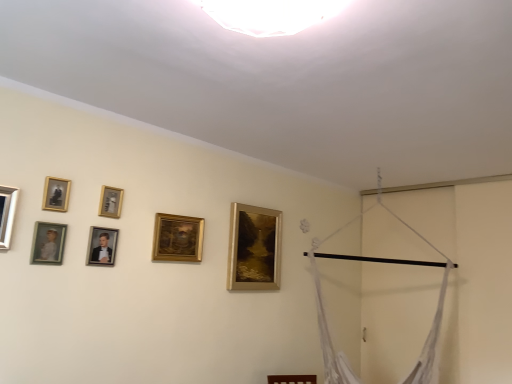
Where is `matte black picture frame at center left, the 4th picture frame from the back`? The width and height of the screenshot is (512, 384). matte black picture frame at center left, the 4th picture frame from the back is located at coordinates (102, 246).

What do you see at coordinates (56, 194) in the screenshot?
I see `gold-framed portrait at upper left, the third picture frame viewed from the front` at bounding box center [56, 194].

Describe the element at coordinates (48, 243) in the screenshot. I see `matte gold picture frame at left, which is the second picture frame in left-to-right order` at that location.

Image resolution: width=512 pixels, height=384 pixels. What do you see at coordinates (254, 248) in the screenshot?
I see `gold/golden frame at upper center, which is the first picture frame in back-to-front order` at bounding box center [254, 248].

This screenshot has height=384, width=512. I want to click on matte black picture frame at center left, which ranks as the 4th picture frame in right-to-left order, so click(x=102, y=246).

Between point (5, 221) and point (234, 284), which one is positioned behind?

The point (234, 284) is farther.

Is matte silver picture frame at left, which is the 7th picture frame in back-to-front order, to the left of gold/golden frame at upper center, positioned as the 7th picture frame in left-to-right order, from the viewer's perspective?

Yes, matte silver picture frame at left, which is the 7th picture frame in back-to-front order, is to the left of gold/golden frame at upper center, positioned as the 7th picture frame in left-to-right order.

Is the surface of matte silver picture frame at left, acting as the 1th picture frame starting from the front, in direct contact with gold/golden frame at upper center, the seventh picture frame positioned from the front?

matte silver picture frame at left, acting as the 1th picture frame starting from the front, and gold/golden frame at upper center, the seventh picture frame positioned from the front, are not in contact.

Does point (191, 251) come farther from viewer compared to point (8, 229)?

Yes, it is.

Based on their sizes in the image, would you say gold metallic picture frame at center, the 6th picture frame in the front-to-back sequence, is bigger or smaller than matte silver picture frame at left, which is the 7th picture frame in back-to-front order?

Clearly, gold metallic picture frame at center, the 6th picture frame in the front-to-back sequence, is larger in size than matte silver picture frame at left, which is the 7th picture frame in back-to-front order.

From a real-world perspective, is gold metallic picture frame at center, the 2th picture frame from the back, positioned over matte silver picture frame at left, acting as the 1th picture frame starting from the front, based on gravity?

No.

Is matte silver picture frame at left, acting as the first picture frame starting from the left, located within gold metallic picture frame at center, which appears as the second picture frame when viewed from the right?

No, matte silver picture frame at left, acting as the first picture frame starting from the left, is not a part of gold metallic picture frame at center, which appears as the second picture frame when viewed from the right.

How different are the orientations of matte silver picture frame at left, acting as the 1th picture frame starting from the front, and gold metallic picture frame at center, the 6th picture frame in the front-to-back sequence, in degrees?

The angular difference between matte silver picture frame at left, acting as the 1th picture frame starting from the front, and gold metallic picture frame at center, the 6th picture frame in the front-to-back sequence, is 0.596 degrees.

Is point (6, 217) behind point (156, 235)?

No.

This screenshot has width=512, height=384. I want to click on the 1st picture frame above the gold metallic picture frame at center, which appears as the second picture frame when viewed from the right (from a real-world perspective), so click(x=7, y=214).

Is matte silver picture frame at left, acting as the 1th picture frame starting from the front, not close to gold metallic picture frame at center, which is the 6th picture frame from left to right?

matte silver picture frame at left, acting as the 1th picture frame starting from the front, is actually quite close to gold metallic picture frame at center, which is the 6th picture frame from left to right.

Could you tell me if gold/golden frame at upper center, which is the first picture frame in back-to-front order, is facing matte black picture frame at center left, the fourth picture frame positioned from the left?

No, gold/golden frame at upper center, which is the first picture frame in back-to-front order, is not aimed at matte black picture frame at center left, the fourth picture frame positioned from the left.

Would you say gold/golden frame at upper center, which is the first picture frame in back-to-front order, is a long distance from matte black picture frame at center left, the fourth picture frame viewed from the front?

Absolutely, gold/golden frame at upper center, which is the first picture frame in back-to-front order, is distant from matte black picture frame at center left, the fourth picture frame viewed from the front.

From a real-world perspective, which object stands above the other?

gold/golden frame at upper center, which is the first picture frame in back-to-front order, from a real-world perspective.

From the image's perspective, is gold/golden frame at upper center, positioned as the 7th picture frame in left-to-right order, on top of matte black picture frame at center left, the fourth picture frame positioned from the left?

No, from the image's perspective, gold/golden frame at upper center, positioned as the 7th picture frame in left-to-right order, is not over matte black picture frame at center left, the fourth picture frame positioned from the left.

Which of these two, matte gold picture frame at left, which appears as the 2th picture frame when viewed from the front, or gold/golden frame at upper center, positioned as the 7th picture frame in left-to-right order, is wider?

Wider between the two is gold/golden frame at upper center, positioned as the 7th picture frame in left-to-right order.

Considering the relative positions of matte gold picture frame at left, which appears as the 2th picture frame when viewed from the front, and gold/golden frame at upper center, which appears as the first picture frame when viewed from the right, in the image provided, is matte gold picture frame at left, which appears as the 2th picture frame when viewed from the front, in front of gold/golden frame at upper center, which appears as the first picture frame when viewed from the right,?

Yes.

Is matte gold picture frame at left, the 6th picture frame in the right-to-left sequence, positioned with its back to gold/golden frame at upper center, which is the first picture frame in back-to-front order?

No, gold/golden frame at upper center, which is the first picture frame in back-to-front order, is not at the back of matte gold picture frame at left, the 6th picture frame in the right-to-left sequence.

From a real-world perspective, is matte gold picture frame at left, which is the second picture frame in left-to-right order, beneath gold/golden frame at upper center, which appears as the first picture frame when viewed from the right?

Yes, from a real-world perspective, matte gold picture frame at left, which is the second picture frame in left-to-right order, is below gold/golden frame at upper center, which appears as the first picture frame when viewed from the right.

Considering the relative positions of matte black picture frame at center left, the 4th picture frame from the back, and gold metallic picture frame at center, the 6th picture frame in the front-to-back sequence, in the image provided, is matte black picture frame at center left, the 4th picture frame from the back, in front of gold metallic picture frame at center, the 6th picture frame in the front-to-back sequence,?

Yes, it is in front of gold metallic picture frame at center, the 6th picture frame in the front-to-back sequence.

Between matte black picture frame at center left, the 4th picture frame from the back, and gold metallic picture frame at center, which appears as the second picture frame when viewed from the right, which one has more height?

Standing taller between the two is gold metallic picture frame at center, which appears as the second picture frame when viewed from the right.

Is gold metallic picture frame at center, which appears as the second picture frame when viewed from the right, at the back of matte black picture frame at center left, the fourth picture frame positioned from the left?

No, matte black picture frame at center left, the fourth picture frame positioned from the left,'s orientation is not away from gold metallic picture frame at center, which appears as the second picture frame when viewed from the right.

From the image's perspective, is matte black picture frame at center left, the 4th picture frame from the back, located above or below gold metallic picture frame at center, the 6th picture frame in the front-to-back sequence?

matte black picture frame at center left, the 4th picture frame from the back, is situated lower than gold metallic picture frame at center, the 6th picture frame in the front-to-back sequence, in the image.

Is matte gold picture frame at left, the 6th picture frame in the right-to-left sequence, in front of or behind gold-framed portrait at upper left, marked as the 5th picture frame in a right-to-left arrangement, in the image?

Visually, matte gold picture frame at left, the 6th picture frame in the right-to-left sequence, is located in front of gold-framed portrait at upper left, marked as the 5th picture frame in a right-to-left arrangement.

From the image's perspective, between matte gold picture frame at left, the 6th picture frame in the right-to-left sequence, and gold-framed portrait at upper left, marked as the 5th picture frame in a right-to-left arrangement, which one is located above?

gold-framed portrait at upper left, marked as the 5th picture frame in a right-to-left arrangement, appears higher in the image.

Considering the sizes of matte gold picture frame at left, which appears as the 2th picture frame when viewed from the front, and gold-framed portrait at upper left, marked as the 5th picture frame in a right-to-left arrangement, in the image, is matte gold picture frame at left, which appears as the 2th picture frame when viewed from the front, taller or shorter than gold-framed portrait at upper left, marked as the 5th picture frame in a right-to-left arrangement,?

In the image, matte gold picture frame at left, which appears as the 2th picture frame when viewed from the front, appears to be taller than gold-framed portrait at upper left, marked as the 5th picture frame in a right-to-left arrangement.

Considering the relative sizes of matte gold picture frame at left, marked as the sixth picture frame in a back-to-front arrangement, and gold-framed portrait at upper left, acting as the fifth picture frame starting from the back, in the image provided, is matte gold picture frame at left, marked as the sixth picture frame in a back-to-front arrangement, smaller than gold-framed portrait at upper left, acting as the fifth picture frame starting from the back,?

No, matte gold picture frame at left, marked as the sixth picture frame in a back-to-front arrangement, is not smaller than gold-framed portrait at upper left, acting as the fifth picture frame starting from the back.

You are a GUI agent. You are given a task and a screenshot of the screen. Output one action in this format:
    pyautogui.click(x=<x>, y=<y>)
    Task: Click on the picture frame that is the 4th object located below the matte silver picture frame at left, placed as the seventh picture frame when sorted from right to left (from the image's perspective)
    The image size is (512, 384).
    Given the screenshot: What is the action you would take?
    pyautogui.click(x=254, y=248)

Where is `picture frame that is the 1st one below the matte silver picture frame at left, acting as the first picture frame starting from the left (from a real-world perspective)`? picture frame that is the 1st one below the matte silver picture frame at left, acting as the first picture frame starting from the left (from a real-world perspective) is located at coordinates (177, 238).

Which object lies further to the anchor point gold metallic picture frame at upper center, which is the 3th picture frame in back-to-front order, gold/golden frame at upper center, which appears as the first picture frame when viewed from the right, or matte black picture frame at center left, which ranks as the 4th picture frame in right-to-left order?

The object further to gold metallic picture frame at upper center, which is the 3th picture frame in back-to-front order, is gold/golden frame at upper center, which appears as the first picture frame when viewed from the right.

Estimate the real-world distances between objects in this image. Which object is further from matte black picture frame at center left, the 4th picture frame from the back, matte gold picture frame at left, which appears as the 2th picture frame when viewed from the front, or gold/golden frame at upper center, positioned as the 7th picture frame in left-to-right order?

gold/golden frame at upper center, positioned as the 7th picture frame in left-to-right order, is positioned further to the anchor matte black picture frame at center left, the 4th picture frame from the back.

From the picture: From the image, which object appears to be farther from matte silver picture frame at left, which is the 7th picture frame in back-to-front order, gold/golden frame at upper center, which is the first picture frame in back-to-front order, or gold-framed portrait at upper left, the third picture frame viewed from the front?

Among the two, gold/golden frame at upper center, which is the first picture frame in back-to-front order, is located further to matte silver picture frame at left, which is the 7th picture frame in back-to-front order.

Considering their positions, is matte black picture frame at center left, the fourth picture frame viewed from the front, positioned closer to gold metallic picture frame at upper center, which is counted as the fifth picture frame, starting from the left, than gold/golden frame at upper center, positioned as the 7th picture frame in left-to-right order?

The object closer to gold metallic picture frame at upper center, which is counted as the fifth picture frame, starting from the left, is matte black picture frame at center left, the fourth picture frame viewed from the front.

Based on their spatial positions, is matte black picture frame at center left, which ranks as the 4th picture frame in right-to-left order, or gold-framed portrait at upper left, acting as the fifth picture frame starting from the back, further from matte silver picture frame at left, acting as the 1th picture frame starting from the front?

matte black picture frame at center left, which ranks as the 4th picture frame in right-to-left order, lies further to matte silver picture frame at left, acting as the 1th picture frame starting from the front, than the other object.

When comparing their distances from gold/golden frame at upper center, positioned as the 7th picture frame in left-to-right order, does gold metallic picture frame at upper center, which is the 3th picture frame in back-to-front order, or matte gold picture frame at left, marked as the sixth picture frame in a back-to-front arrangement, seem closer?

Among the two, gold metallic picture frame at upper center, which is the 3th picture frame in back-to-front order, is located nearer to gold/golden frame at upper center, positioned as the 7th picture frame in left-to-right order.

When comparing their distances from gold/golden frame at upper center, positioned as the 7th picture frame in left-to-right order, does matte silver picture frame at left, which is the 7th picture frame in back-to-front order, or matte gold picture frame at left, marked as the sixth picture frame in a back-to-front arrangement, seem closer?

matte gold picture frame at left, marked as the sixth picture frame in a back-to-front arrangement, is closer to gold/golden frame at upper center, positioned as the 7th picture frame in left-to-right order.

Which object lies nearer to the anchor point matte gold picture frame at left, which appears as the 2th picture frame when viewed from the front, matte silver picture frame at left, acting as the first picture frame starting from the left, or gold-framed portrait at upper left, acting as the fifth picture frame starting from the back?

Among the two, gold-framed portrait at upper left, acting as the fifth picture frame starting from the back, is located nearer to matte gold picture frame at left, which appears as the 2th picture frame when viewed from the front.

Identify the location of picture frame between matte silver picture frame at left, which is the 7th picture frame in back-to-front order, and gold-framed portrait at upper left, positioned as the third picture frame in left-to-right order, from front to back. This screenshot has width=512, height=384. (48, 243).

Image resolution: width=512 pixels, height=384 pixels. Find the location of `picture frame situated between matte black picture frame at center left, the 4th picture frame from the back, and gold metallic picture frame at center, which appears as the second picture frame when viewed from the right, from left to right`. picture frame situated between matte black picture frame at center left, the 4th picture frame from the back, and gold metallic picture frame at center, which appears as the second picture frame when viewed from the right, from left to right is located at coordinates (111, 202).

At what (x,y) coordinates should I click in order to perform the action: click on picture frame between gold metallic picture frame at upper center, the 3th picture frame viewed from the right, and gold/golden frame at upper center, positioned as the 7th picture frame in left-to-right order, in the horizontal direction. Please return your answer as a coordinate pair (x, y). This screenshot has width=512, height=384. Looking at the image, I should click on (177, 238).